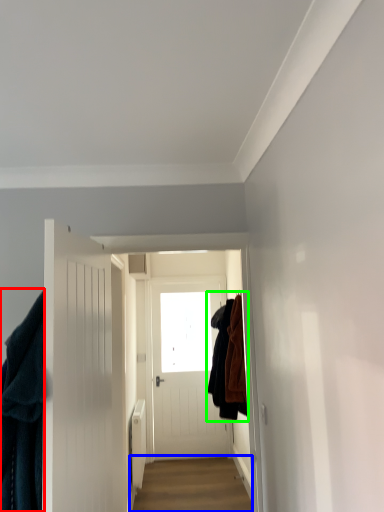
Question: Which object is positioned farthest from clothing (highlighted by a red box)? Select from alley (highlighted by a blue box) and clothing (highlighted by a green box).

Choices:
 (A) alley
 (B) clothing

Answer: (A)